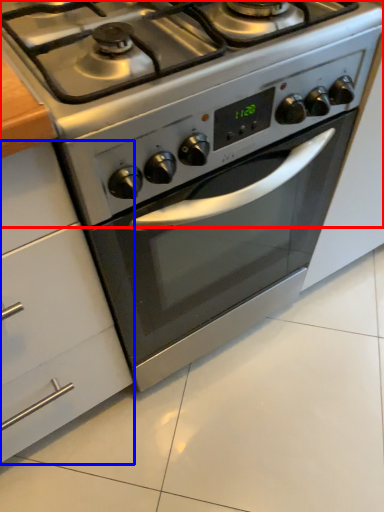
Question: Which point is further to the camera, gas stove (highlighted by a red box) or cabinetry (highlighted by a blue box)?

Choices:
 (A) gas stove
 (B) cabinetry

Answer: (A)